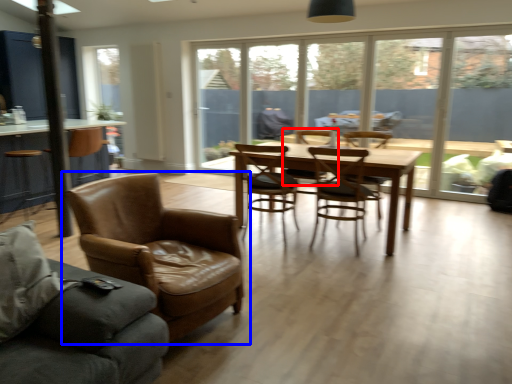
Question: Which object appears farthest to the camera in this image, chair (highlighted by a red box) or chair (highlighted by a blue box)?

Choices:
 (A) chair
 (B) chair

Answer: (A)